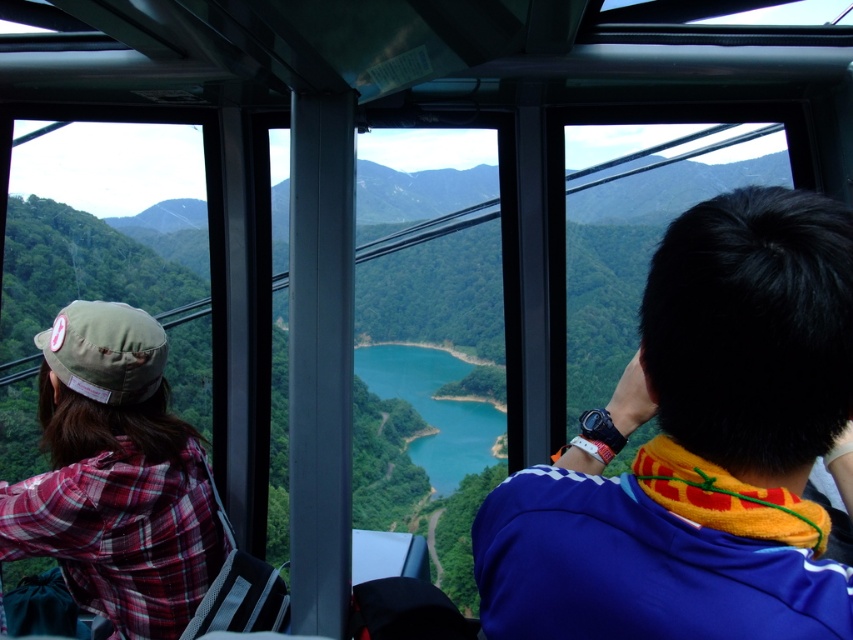
You are a tour guide explaining the seating arrangement inside the cable car. You need to inform a visitor how far apart the blue fabric jacket at center and the plaid fabric shirt at left are. What do you tell them?

The blue fabric jacket at center and the plaid fabric shirt at left are 6.32 feet apart.

You are inside a cable car and want to know the exact coordinates of the blue fabric jacket at center. What are its coordinates?

The blue fabric jacket at center is located at coordinates point (699, 449).